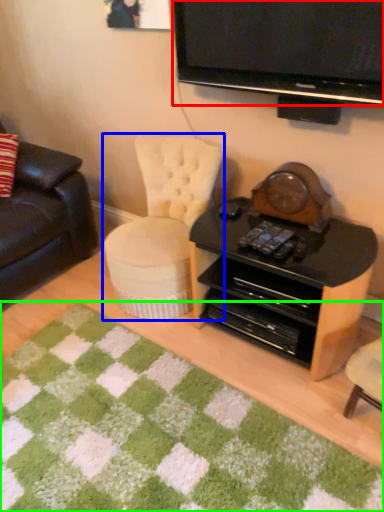
Question: Which is farther away from television (highlighted by a red box)? chair (highlighted by a blue box) or mat (highlighted by a green box)?

Choices:
 (A) chair
 (B) mat

Answer: (B)